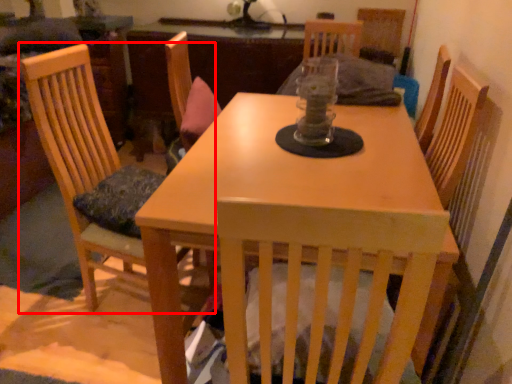
Question: From the image's perspective, what is the correct spatial positioning of chair (annotated by the red box) in reference to table?

Choices:
 (A) below
 (B) above

Answer: (B)